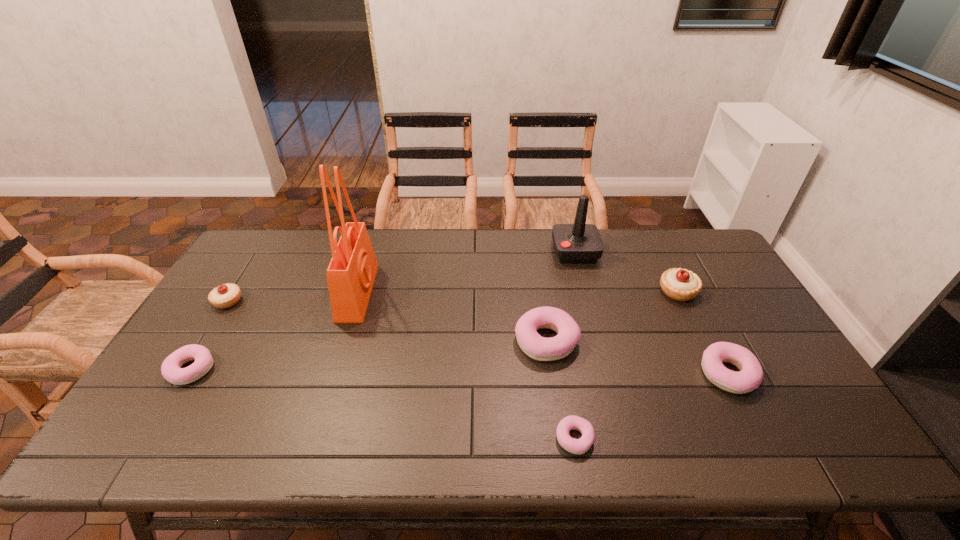
Locate which object is the third closest to the bigger beige pastry. Please provide its 2D coordinates. Your answer should be formatted as a tuple, i.e. [(x, y)], where the tuple contains the x and y coordinates of a point satisfying the conditions above.

[(537, 347)]

At what (x,y) coordinates should I click in order to perform the action: click on pastry that is the second closest to the fourth tallest pastry. Please return your answer as a coordinate pair (x, y). The width and height of the screenshot is (960, 540). Looking at the image, I should click on (537, 347).

Choose which pastry is the second nearest neighbor to the fourth tallest pastry. Please provide its 2D coordinates. Your answer should be formatted as a tuple, i.e. [(x, y)], where the tuple contains the x and y coordinates of a point satisfying the conditions above.

[(537, 347)]

You are a GUI agent. You are given a task and a screenshot of the screen. Output one action in this format:
    pyautogui.click(x=<x>, y=<y>)
    Task: Click on the second closest pink pastry to the bigger beige pastry
    
    Given the screenshot: What is the action you would take?
    pyautogui.click(x=537, y=347)

Point out which pink pastry is positioned as the second nearest to the tallest pastry. Please provide its 2D coordinates. Your answer should be formatted as a tuple, i.e. [(x, y)], where the tuple contains the x and y coordinates of a point satisfying the conditions above.

[(537, 347)]

The width and height of the screenshot is (960, 540). What are the coordinates of `free spot that satisfies the following two spatial constraints: 1. on the logo side of the tote bag; 2. on the front side of the smaller beige pastry` in the screenshot? It's located at (355, 301).

Identify the location of free space that satisfies the following two spatial constraints: 1. on the back side of the second smallest pink pastry; 2. on the right side of the biggest pink pastry. The height and width of the screenshot is (540, 960). (208, 340).

Where is `vacant area that satisfies the following two spatial constraints: 1. on the logo side of the tote bag; 2. on the back side of the third smallest pink pastry`? vacant area that satisfies the following two spatial constraints: 1. on the logo side of the tote bag; 2. on the back side of the third smallest pink pastry is located at coordinates (332, 374).

Locate an element on the screen. The height and width of the screenshot is (540, 960). free spot that satisfies the following two spatial constraints: 1. on the logo side of the shortest pastry; 2. on the right side of the third object from left to right is located at coordinates (313, 438).